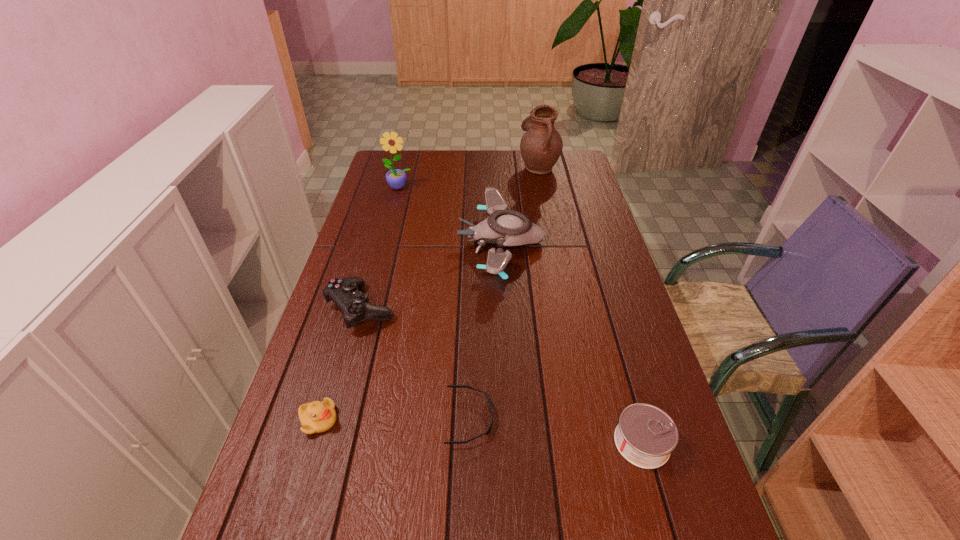
The height and width of the screenshot is (540, 960). Identify the location of control that is at the left edge. (354, 304).

What are the coordinates of `duckling situated at the left edge` in the screenshot? It's located at click(x=315, y=417).

Locate an element on the screen. pitcher that is positioned at the right edge is located at coordinates (541, 145).

Identify the location of can present at the right edge. (645, 436).

Identify the location of object located in the far right corner section of the desktop. (541, 145).

Where is `vacant area at the far edge of the desktop`? The height and width of the screenshot is (540, 960). vacant area at the far edge of the desktop is located at coordinates point(484,167).

Image resolution: width=960 pixels, height=540 pixels. Identify the location of vacant position at the left edge of the desktop. (371, 195).

Image resolution: width=960 pixels, height=540 pixels. Find the location of `vacant space at the right edge of the desktop`. vacant space at the right edge of the desktop is located at coordinates (577, 259).

This screenshot has height=540, width=960. Identify the location of unoccupied position between the can and the duckling. (480, 431).

This screenshot has height=540, width=960. What are the coordinates of `vacant space in between the drone and the can` in the screenshot? It's located at (571, 342).